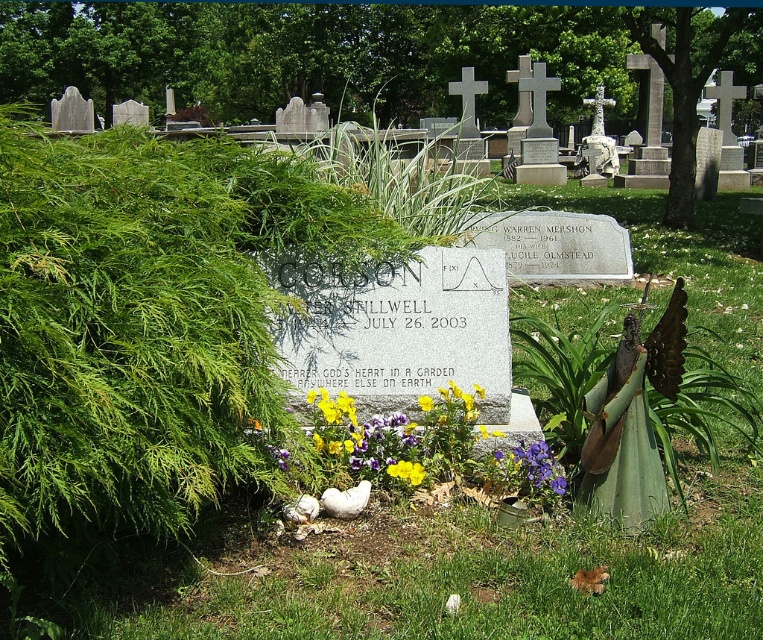
Question: In this image, where is purple matte flower at center located relative to white stone cross at center?

Choices:
 (A) right
 (B) left

Answer: (B)

Question: Is green leafy bush at left thinner than yellow matte flower at center?

Choices:
 (A) no
 (B) yes

Answer: (A)

Question: Which is farther from the purple matte flower at center?

Choices:
 (A) white stone cross at center
 (B) green leafy bush at left

Answer: (A)

Question: Which of these objects is positioned closest to the white stone cross at center?

Choices:
 (A) yellow matte flower at center
 (B) green leafy bush at left
 (C) purple matte flower at center

Answer: (A)

Question: Which point is farther to the camera?

Choices:
 (A) (549, 483)
 (B) (604, 148)
 (C) (423, 401)

Answer: (B)

Question: Is green leafy bush at left smaller than yellow matte flower at center?

Choices:
 (A) no
 (B) yes

Answer: (A)